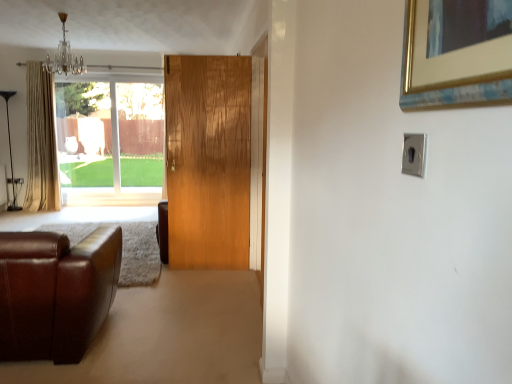
Where is `crystal glass chandelier at upper left`? crystal glass chandelier at upper left is located at coordinates (64, 56).

From a real-world perspective, is wooden door at center positioned under beige fabric curtain at left based on gravity?

Yes, from a real-world perspective, wooden door at center is beneath beige fabric curtain at left.

Considering the relative positions of wooden door at center and beige fabric curtain at left in the image provided, is wooden door at center to the left or to the right of beige fabric curtain at left?

Based on their positions, wooden door at center is located to the right of beige fabric curtain at left.

Locate an element on the screen. The image size is (512, 384). curtain located above the wooden door at center (from a real-world perspective) is located at coordinates (41, 142).

Looking at this image, would you say beige fabric curtain at left is part of wooden door at center's contents?

No, beige fabric curtain at left is located outside of wooden door at center.

Is the surface of beige fabric curtain at left in direct contact with crystal glass chandelier at upper left?

No, beige fabric curtain at left is not making contact with crystal glass chandelier at upper left.

Considering the positions of objects beige fabric curtain at left and crystal glass chandelier at upper left in the image provided, who is more to the left, beige fabric curtain at left or crystal glass chandelier at upper left?

beige fabric curtain at left.

From the image's perspective, which is below, beige fabric curtain at left or crystal glass chandelier at upper left?

beige fabric curtain at left appears lower in the image.

From a real-world perspective, who is located lower, beige fabric curtain at left or crystal glass chandelier at upper left?

beige fabric curtain at left.

Which of these two, clear glass window at upper left or satin silver switch at upper right, is smaller?

Smaller between the two is satin silver switch at upper right.

In the scene shown: Is clear glass window at upper left positioned behind satin silver switch at upper right?

Yes, clear glass window at upper left is behind satin silver switch at upper right.

Can you see clear glass window at upper left touching satin silver switch at upper right?

No, clear glass window at upper left is not beside satin silver switch at upper right.

From the image's perspective, is clear glass window at upper left above or below satin silver switch at upper right?

From the image's perspective, clear glass window at upper left appears above satin silver switch at upper right.

From a real-world perspective, between beige fabric curtain at left and clear glass window at upper left, who is vertically lower?

clear glass window at upper left, from a real-world perspective.

Locate an element on the screen. This screenshot has height=384, width=512. curtain located on the left of clear glass window at upper left is located at coordinates (41, 142).

Considering the positions of objects beige fabric curtain at left and clear glass window at upper left in the image provided, who is more to the left, beige fabric curtain at left or clear glass window at upper left?

beige fabric curtain at left is more to the left.

Is satin silver switch at upper right not close to crystal glass chandelier at upper left?

satin silver switch at upper right is positioned a significant distance from crystal glass chandelier at upper left.

In the scene shown: Considering the sizes of objects satin silver switch at upper right and crystal glass chandelier at upper left in the image provided, who is shorter, satin silver switch at upper right or crystal glass chandelier at upper left?

Standing shorter between the two is satin silver switch at upper right.

Is crystal glass chandelier at upper left a part of satin silver switch at upper right?

No, crystal glass chandelier at upper left is located outside of satin silver switch at upper right.

Which is less distant, (425,158) or (68,72)?

Positioned in front is point (425,158).

Who is bigger, beige fabric curtain at left or brown leather couch at lower left?

brown leather couch at lower left.

Can you confirm if beige fabric curtain at left is taller than brown leather couch at lower left?

Indeed, beige fabric curtain at left has a greater height compared to brown leather couch at lower left.

Considering the sizes of objects beige fabric curtain at left and brown leather couch at lower left in the image provided, who is thinner, beige fabric curtain at left or brown leather couch at lower left?

With smaller width is beige fabric curtain at left.

Is point (39, 92) closer to viewer compared to point (64, 274)?

That is False.

Consider the image. Is clear glass window at upper left completely or partially outside of wooden door at center?

Yes.

Which is closer to the camera, (109,118) or (225,119)?

The point (225,119) is closer to the camera.

Is clear glass window at upper left taller or shorter than wooden door at center?

Clearly, clear glass window at upper left is shorter compared to wooden door at center.

How many degrees apart are the facing directions of clear glass window at upper left and wooden door at center?

There is a 8.7-degree angle between the facing directions of clear glass window at upper left and wooden door at center.

You are a GUI agent. You are given a task and a screenshot of the screen. Output one action in this format:
    pyautogui.click(x=<x>, y=<y>)
    Task: Click on the curtain on the left of wooden door at center
    The width and height of the screenshot is (512, 384).
    Given the screenshot: What is the action you would take?
    pyautogui.click(x=41, y=142)

At what (x,y) coordinates should I click in order to perform the action: click on light fixture on the right side of beige fabric curtain at left. Please return your answer as a coordinate pair (x, y). The width and height of the screenshot is (512, 384). Looking at the image, I should click on pos(64,56).

Estimate the real-world distances between objects in this image. Which object is further from wooden door at center, crystal glass chandelier at upper left or brown leather couch at lower left?

Among the two, crystal glass chandelier at upper left is located further to wooden door at center.

Which object lies further to the anchor point clear glass window at upper left, satin silver switch at upper right or crystal glass chandelier at upper left?

The object further to clear glass window at upper left is satin silver switch at upper right.

Which object lies further to the anchor point brown leather couch at lower left, wooden door at center or crystal glass chandelier at upper left?

crystal glass chandelier at upper left is further to brown leather couch at lower left.

Looking at the image, which one is located further to beige fabric curtain at left, clear glass window at upper left or wooden door at center?

wooden door at center lies further to beige fabric curtain at left than the other object.

Based on their spatial positions, is clear glass window at upper left or crystal glass chandelier at upper left closer to brown leather couch at lower left?

The object closer to brown leather couch at lower left is crystal glass chandelier at upper left.

Considering their positions, is wooden door at center positioned closer to brown leather couch at lower left than beige fabric curtain at left?

wooden door at center is closer to brown leather couch at lower left.

Estimate the real-world distances between objects in this image. Which object is closer to beige fabric curtain at left, satin silver switch at upper right or wooden door at center?

Based on the image, wooden door at center appears to be nearer to beige fabric curtain at left.

Based on their spatial positions, is brown leather couch at lower left or satin silver switch at upper right closer to clear glass window at upper left?

The object closer to clear glass window at upper left is brown leather couch at lower left.

Where is `door between satin silver switch at upper right and crystal glass chandelier at upper left from front to back`? door between satin silver switch at upper right and crystal glass chandelier at upper left from front to back is located at coordinates (208, 160).

The height and width of the screenshot is (384, 512). Identify the location of curtain between satin silver switch at upper right and clear glass window at upper left from front to back. (41, 142).

Where is `light fixture between satin silver switch at upper right and clear glass window at upper left in the front-back direction`? The width and height of the screenshot is (512, 384). light fixture between satin silver switch at upper right and clear glass window at upper left in the front-back direction is located at coordinates (64, 56).

Locate an element on the screen. studio couch located between satin silver switch at upper right and beige fabric curtain at left in the depth direction is located at coordinates (55, 292).